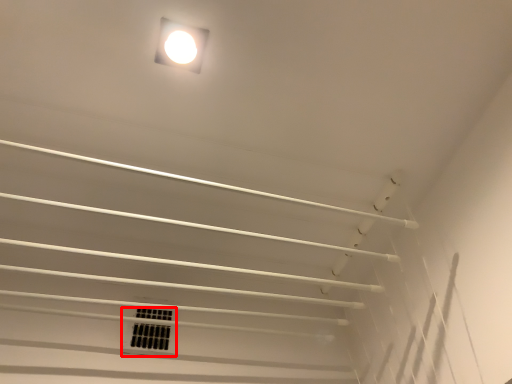
Question: From the image's perspective, where is window (annotated by the red box) located in relation to lamp in the image?

Choices:
 (A) above
 (B) below

Answer: (B)